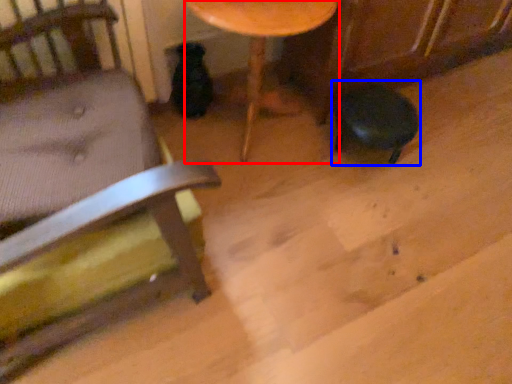
Question: Which object appears farthest to the camera in this image, table (highlighted by a red box) or bar stool (highlighted by a blue box)?

Choices:
 (A) table
 (B) bar stool

Answer: (B)